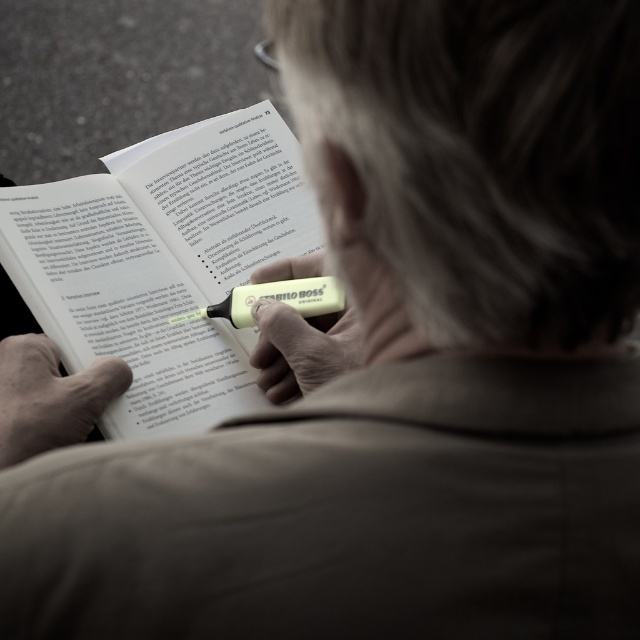
You are a student who needs to choose between the yellow highlighter at center and the yellow matte highlighter at center to mark important text in your book. Which one is taller and better for reaching the top of the page?

The yellow highlighter at center is taller than the yellow matte highlighter at center, so it would be better for reaching the top of the page.

You are a photographer trying to capture a closeup of the book the person is reading. You want to focus on the page number 73. However, there are two points in the image that might interfere with your focus. The first point is at coordinate point (x=97, y=358) and the second is at coordinate point (x=323, y=369). Which point should you avoid focusing on to ensure the page number 73 is in focus?

You should avoid focusing on point (x=323, y=369) because point (x=97, y=358) is behind it. Since the page number 73 is on the book being read, focusing on the closer point would keep the page number in focus.

You are a photographer trying to capture the yellow highlighter at center and the smooth beige hand at lower left in a clear shot. Based on their positions, which object should you focus on first to ensure both are in focus?

The yellow highlighter at center is positioned on the right side of smooth beige hand at lower left. Since the yellow highlighter at center is closer to the camera than the hand, you should focus on the yellow highlighter at center first to ensure both are in focus.